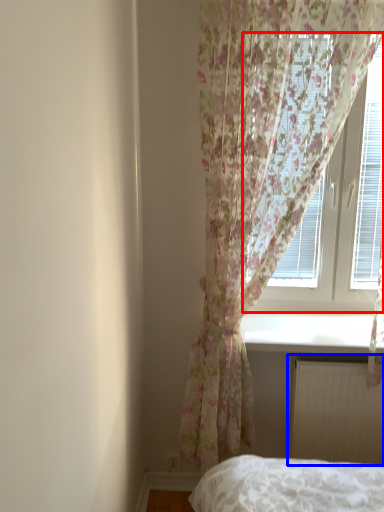
Question: Which object appears farthest to the camera in this image, window (highlighted by a red box) or radiator (highlighted by a blue box)?

Choices:
 (A) window
 (B) radiator

Answer: (A)